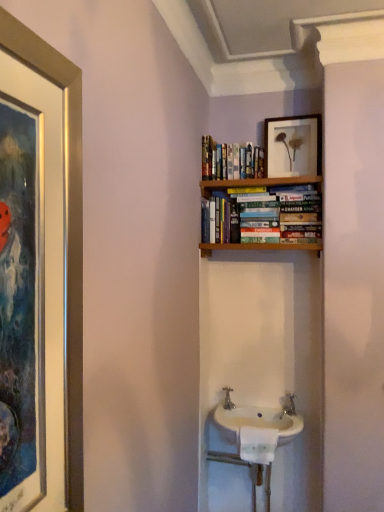
You are a GUI agent. You are given a task and a screenshot of the screen. Output one action in this format:
    pyautogui.click(x=<x>, y=<y>)
    Task: Click on the white ceramic sink at center
    This screenshot has width=384, height=512.
    Given the screenshot: What is the action you would take?
    pyautogui.click(x=258, y=420)

The width and height of the screenshot is (384, 512). I want to click on hardcover books at upper center, so click(x=231, y=161).

Describe the element at coordinates (231, 161) in the screenshot. I see `hardcover books at upper center` at that location.

What do you see at coordinates (228, 399) in the screenshot? The height and width of the screenshot is (512, 384). I see `silver metallic tap at center` at bounding box center [228, 399].

What is the approximate height of matte wooden picture frame at upper center?

matte wooden picture frame at upper center is 10.85 inches tall.

In order to face matte wooden picture frame at upper center, should I rotate leftwards or rightwards?

You should rotate right by 13.592 degrees.

Locate an element on the screen. Image resolution: width=384 pixels, height=512 pixels. white ceramic sink at center is located at coordinates (258, 420).

Can you confirm if matte wooden picture frame at upper center is bigger than silver metallic tap at center?

Yes.

From a real-world perspective, which is physically above, matte wooden picture frame at upper center or silver metallic tap at center?

matte wooden picture frame at upper center, from a real-world perspective.

Considering the positions of point (281, 161) and point (230, 409), is point (281, 161) closer or farther from the camera than point (230, 409)?

Point (281, 161) appears to be closer to the viewer than point (230, 409).

Does point (234, 405) lie behind point (317, 154)?

Yes, it is.

Is silver metallic tap at center bigger or smaller than matte wooden picture frame at upper center?

Clearly, silver metallic tap at center is smaller in size than matte wooden picture frame at upper center.

Would you say silver metallic tap at center is inside or outside matte wooden picture frame at upper center?

silver metallic tap at center is spatially situated outside matte wooden picture frame at upper center.

Is there a large distance between silver metallic tap at center and matte wooden picture frame at upper center?

Yes, silver metallic tap at center and matte wooden picture frame at upper center are located far from each other.

Is white ceramic sink at center positioned in front of matte wooden picture frame at upper center?

Yes, white ceramic sink at center is closer to the camera.

Which is behind, point (253, 416) or point (266, 158)?

The point (266, 158) is behind.

Which is more to the right, white ceramic sink at center or matte wooden picture frame at upper center?

From the viewer's perspective, matte wooden picture frame at upper center appears more on the right side.

Looking at their sizes, would you say white ceramic sink at center is wider or thinner than matte wooden picture frame at upper center?

white ceramic sink at center is wider than matte wooden picture frame at upper center.

Does matte wooden picture frame at upper center have a lesser width compared to white ceramic sink at center?

Correct, the width of matte wooden picture frame at upper center is less than that of white ceramic sink at center.

Where is `sink below the matte wooden picture frame at upper center (from a real-world perspective)`? This screenshot has width=384, height=512. sink below the matte wooden picture frame at upper center (from a real-world perspective) is located at coordinates (258, 420).

Can you tell me how much matte wooden picture frame at upper center and white ceramic sink at center differ in facing direction?

There is a 1.76-degree angle between the facing directions of matte wooden picture frame at upper center and white ceramic sink at center.

Can you confirm if matte wooden picture frame at upper center is taller than white ceramic sink at center?

Yes.

Considering the relative sizes of white ceramic sink at center and silver metallic tap at center in the image provided, is white ceramic sink at center shorter than silver metallic tap at center?

Yes.

Is white ceramic sink at center in contact with silver metallic tap at center?

No, white ceramic sink at center is not touching silver metallic tap at center.

Considering the positions of point (286, 442) and point (227, 388), is point (286, 442) closer or farther from the camera than point (227, 388)?

Point (286, 442) is closer to the camera than point (227, 388).

Would you say hardcover books at upper center is a long distance from silver metallic tap at center?

Yes, hardcover books at upper center and silver metallic tap at center are located far from each other.

Is hardcover books at upper center wider or thinner than silver metallic tap at center?

Considering their sizes, hardcover books at upper center looks broader than silver metallic tap at center.

Locate an element on the screen. The height and width of the screenshot is (512, 384). book located on the right of silver metallic tap at center is located at coordinates (231, 161).

Which is in front, point (231, 405) or point (250, 426)?

The point (250, 426) is more forward.

Based on their sizes in the image, would you say silver metallic tap at center is bigger or smaller than white ceramic sink at center?

silver metallic tap at center is smaller than white ceramic sink at center.

Which is more to the left, silver metallic tap at center or white ceramic sink at center?

From the viewer's perspective, silver metallic tap at center appears more on the left side.

What's the angular difference between silver metallic tap at center and white ceramic sink at center's facing directions?

0.00355 degrees separate the facing orientations of silver metallic tap at center and white ceramic sink at center.

Locate an element on the screen. This screenshot has width=384, height=512. tap that appears below the matte wooden picture frame at upper center (from the image's perspective) is located at coordinates (228, 399).

In order to click on picture frame that is above the silver metallic tap at center (from the image's perspective) in this screenshot , I will do `click(293, 146)`.

When comparing their distances from hardcover books at upper center, does silver metallic tap at center or white ceramic sink at center seem closer?

Among the two, silver metallic tap at center is located nearer to hardcover books at upper center.

Estimate the real-world distances between objects in this image. Which object is further from white ceramic sink at center, silver metallic tap at center or matte wooden picture frame at upper center?

matte wooden picture frame at upper center is positioned further to the anchor white ceramic sink at center.

Which object lies nearer to the anchor point white ceramic sink at center, matte wooden picture frame at upper center or hardcover books at upper center?

hardcover books at upper center is closer to white ceramic sink at center.

Which object lies nearer to the anchor point hardcover books at upper center, white ceramic sink at center or silver metallic tap at center?

silver metallic tap at center lies closer to hardcover books at upper center than the other object.

When comparing their distances from silver metallic tap at center, does matte wooden picture frame at upper center or hardcover books at upper center seem closer?

Among the two, hardcover books at upper center is located nearer to silver metallic tap at center.

Looking at the image, which one is located closer to matte wooden picture frame at upper center, hardcover books at upper center or silver metallic tap at center?

The object closer to matte wooden picture frame at upper center is hardcover books at upper center.

Estimate the real-world distances between objects in this image. Which object is further from hardcover books at upper center, matte wooden picture frame at upper center or silver metallic tap at center?

Among the two, silver metallic tap at center is located further to hardcover books at upper center.

Looking at this image, when comparing their distances from hardcover books at upper center, does white ceramic sink at center or matte wooden picture frame at upper center seem closer?

Among the two, matte wooden picture frame at upper center is located nearer to hardcover books at upper center.

Locate an element on the screen. tap between matte wooden picture frame at upper center and white ceramic sink at center in the vertical direction is located at coordinates (228, 399).

Identify the location of tap between hardcover books at upper center and white ceramic sink at center vertically. (228, 399).

The width and height of the screenshot is (384, 512). In order to click on book between matte wooden picture frame at upper center and white ceramic sink at center in the vertical direction in this screenshot , I will do `click(231, 161)`.

Locate an element on the screen. Image resolution: width=384 pixels, height=512 pixels. book between matte wooden picture frame at upper center and silver metallic tap at center in the vertical direction is located at coordinates (231, 161).